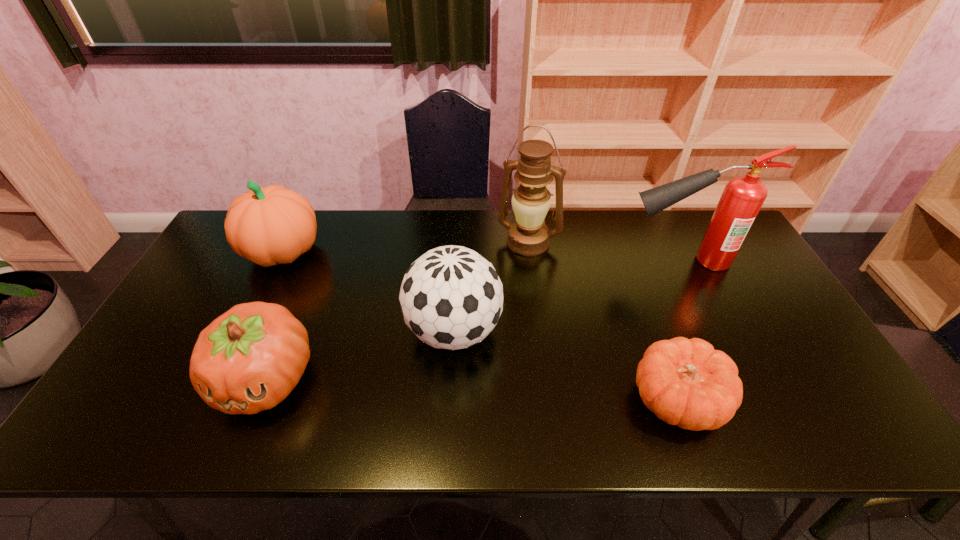
Identify the location of free location that satisfies the following two spatial constraints: 1. on the side of the second shortest object with the cute face; 2. on the left side of the shortest object. (257, 401).

At what (x,y) coordinates should I click in order to perform the action: click on free space that satisfies the following two spatial constraints: 1. at the nozzle of the fire extinguisher; 2. on the side of the second shortest pumpkin with the cute face. Please return your answer as a coordinate pair (x, y). Looking at the image, I should click on (739, 379).

Locate an element on the screen. The image size is (960, 540). free space in the image that satisfies the following two spatial constraints: 1. on the front side of the tallest pumpkin; 2. on the right side of the fourth object from right to left is located at coordinates (244, 331).